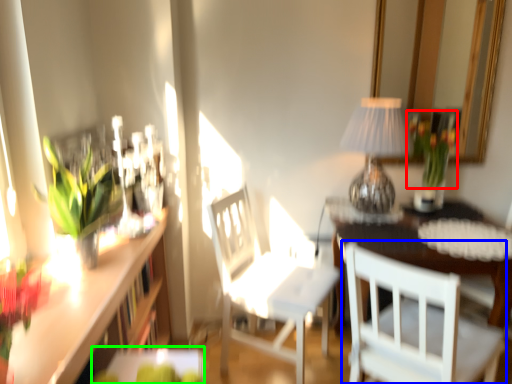
Question: Which object is the closest to the floral arrangement (highlighted by a red box)? Choose among these: chair (highlighted by a blue box) or table (highlighted by a green box).

Choices:
 (A) chair
 (B) table

Answer: (A)